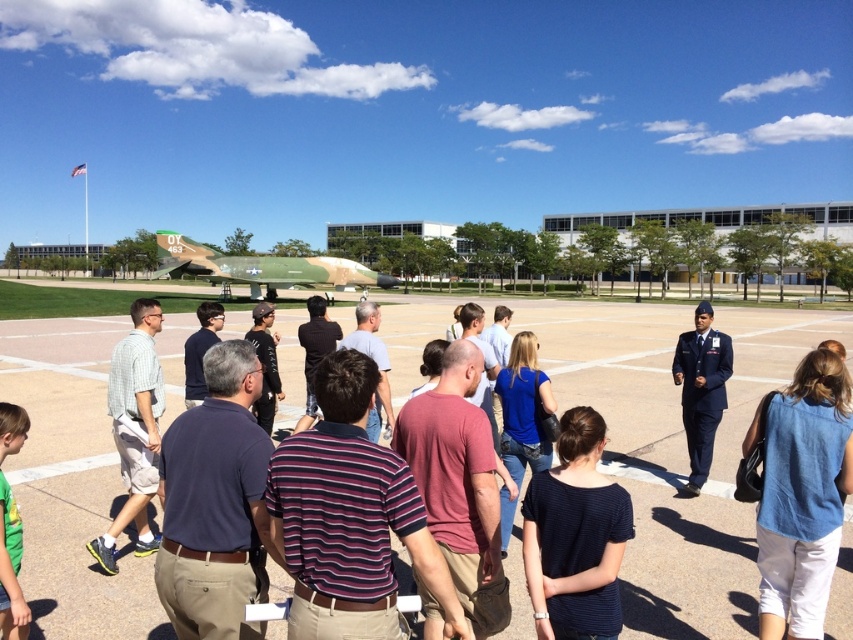
Who is lower down, blue cotton shirt at lower right or camouflage paint airplane at center?

blue cotton shirt at lower right is lower down.

Which is in front, point (817, 369) or point (212, 276)?

Positioned in front is point (817, 369).

Is point (820, 602) closer to camera compared to point (251, 280)?

Yes, point (820, 602) is closer to viewer.

This screenshot has width=853, height=640. Identify the location of blue cotton shirt at lower right. (801, 493).

Does point (175, 275) lie behind point (697, 422)?

Yes, point (175, 275) is farther from viewer.

Which is in front, point (172, 244) or point (695, 328)?

Point (695, 328) is more forward.

The width and height of the screenshot is (853, 640). Find the location of `camouflage paint airplane at center`. camouflage paint airplane at center is located at coordinates (262, 268).

Is dark blue striped shirt at center above camouflage paint airplane at center?

No.

Does dark blue striped shirt at center have a lesser height compared to camouflage paint airplane at center?

Yes.

What are the coordinates of `dark blue striped shirt at center` in the screenshot? It's located at (575, 536).